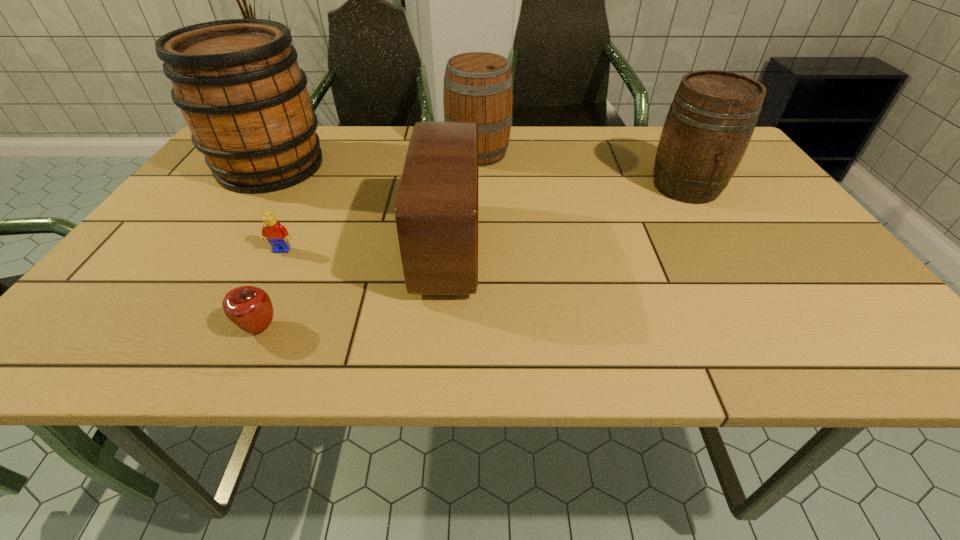
The image size is (960, 540). What are the coordinates of `the leftmost cider` in the screenshot? It's located at (243, 96).

Image resolution: width=960 pixels, height=540 pixels. What are the coordinates of `the tallest object` in the screenshot? It's located at (243, 96).

The height and width of the screenshot is (540, 960). I want to click on the rightmost object, so point(712,117).

Locate an element on the screen. The width and height of the screenshot is (960, 540). the second cider from left to right is located at coordinates (478, 87).

Identify the location of radio receiver. This screenshot has width=960, height=540. (436, 212).

Identify the location of Lego. (276, 234).

Locate an element on the screen. The height and width of the screenshot is (540, 960). the nearest object is located at coordinates (250, 308).

Find the location of a particular element. This screenshot has height=540, width=960. free space located 0.320m on the front of the tallest cider is located at coordinates (188, 291).

Where is `vacant area located 0.400m on the side of the rightmost cider near the bung hole`? This screenshot has width=960, height=540. vacant area located 0.400m on the side of the rightmost cider near the bung hole is located at coordinates (782, 343).

Find the location of a particular element. vacant space situated 0.400m on the right of the second cider from left to right is located at coordinates (653, 153).